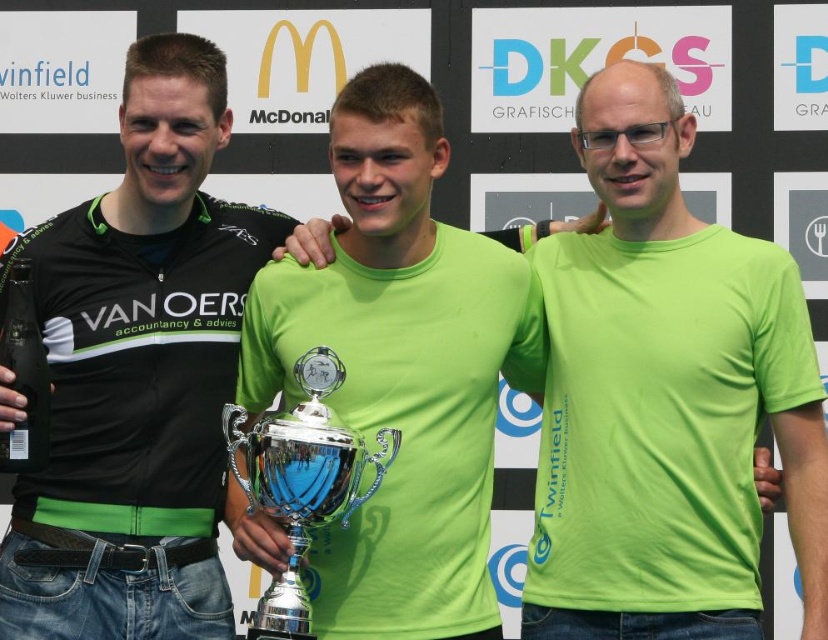
Does black jersey at left have a lesser width compared to neon green t-shirt at center?

Incorrect, black jersey at left's width is not less than neon green t-shirt at center's.

Measure the distance from black jersey at left to neon green t-shirt at center.

14.07 meters

Describe the element at coordinates (138, 372) in the screenshot. I see `black jersey at left` at that location.

Locate an element on the screen. Image resolution: width=828 pixels, height=640 pixels. black jersey at left is located at coordinates (138, 372).

Does neon green t-shirt at center have a lesser height compared to silver shiny trophy at center?

No.

Is point (600, 120) behind point (392, 438)?

That is True.

At what (x,y) coordinates should I click in order to perform the action: click on neon green t-shirt at center. Please return your answer as a coordinate pair (x, y). The width and height of the screenshot is (828, 640). Looking at the image, I should click on (638, 529).

Is black jersey at left to the left of silver shiny trophy at center from the viewer's perspective?

Yes, black jersey at left is to the left of silver shiny trophy at center.

Is black jersey at left bigger than silver shiny trophy at center?

Yes.

Where is `black jersey at left`? The width and height of the screenshot is (828, 640). black jersey at left is located at coordinates (138, 372).